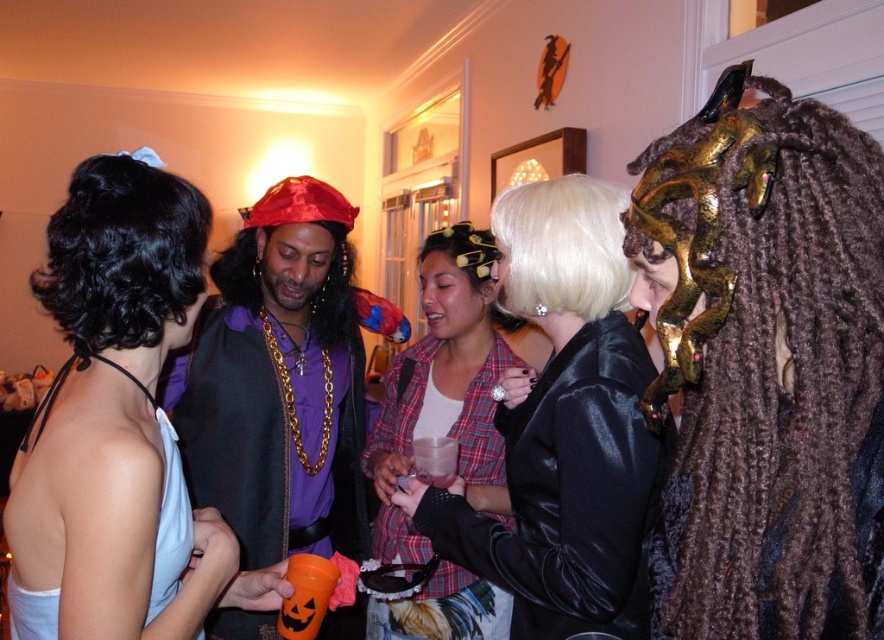
Question: Does blonde synthetic wig at upper center have a greater width compared to orange plastic cup at center?

Choices:
 (A) no
 (B) yes

Answer: (B)

Question: Does shiny black leather jacket at center have a lesser width compared to black curly wig at upper left?

Choices:
 (A) no
 (B) yes

Answer: (A)

Question: Does shiny gold chain at center appear on the left side of translucent plastic cup at center?

Choices:
 (A) no
 (B) yes

Answer: (B)

Question: Estimate the real-world distances between objects in this image. Which object is farther from the plaid fabric shirt at center?

Choices:
 (A) orange plastic cup at lower left
 (B) orange plastic cup at center
 (C) translucent plastic cup at center
 (D) shiny gold chain at center

Answer: (A)

Question: Estimate the real-world distances between objects in this image. Which object is farther from the white satin dress at upper left?

Choices:
 (A) blonde synthetic wig at upper center
 (B) plaid fabric shirt at center

Answer: (B)

Question: Which of these objects is positioned closest to the shiny gold mask at center?

Choices:
 (A) blonde synthetic wig at upper center
 (B) plaid fabric shirt at center
 (C) white satin dress at upper left

Answer: (A)